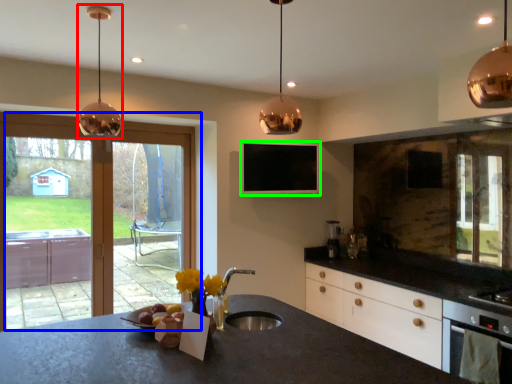
Question: Which is nearer to the lamp (highlighted by a red box)? window (highlighted by a blue box) or window screen (highlighted by a green box).

Choices:
 (A) window
 (B) window screen

Answer: (A)